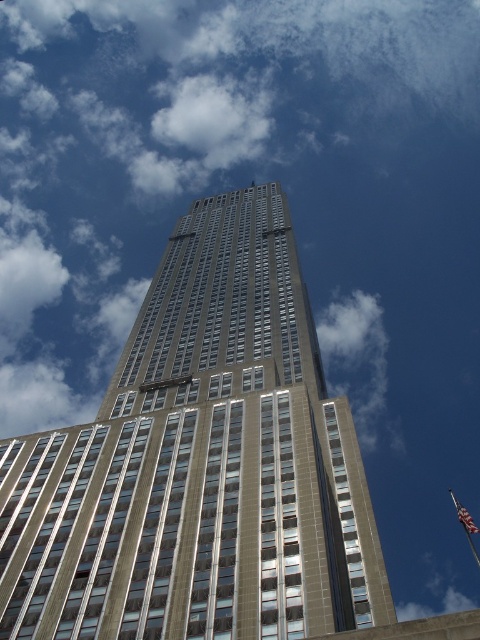
You are standing at the base of the skyscraper and want to reach a specific point marked at coordinates point (14, 600). If your current position is 100 feet away from the building, can you estimate whether the marked point is within your reach?

The distance of point (14, 600) from viewer is 152.85 feet. Since you are currently 100 feet away from the building, the marked point is farther away than your current position, so it is out of reach.

You are standing at the base of the beige glass skyscraper at center. If you want to take a photo of the entire building without moving your position, will you need a wide angle lens?

The beige glass skyscraper at center is 39.97 meters away from viewer. Since the distance is relatively far, a wide angle lens would help capture the entire structure in one frame without moving your position.

You are a photographer standing in front of the beige glass skyscraper at center and the american flag at upper right. You want to take a photo that captures both objects in the frame. Considering their sizes, which object will appear bigger in your photo?

The beige glass skyscraper at center will appear bigger in the photo because it is larger in size than the american flag at upper right according to the description.